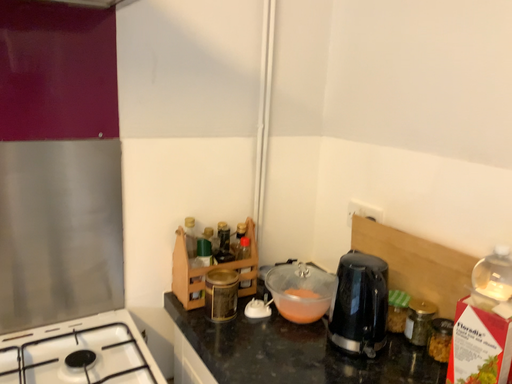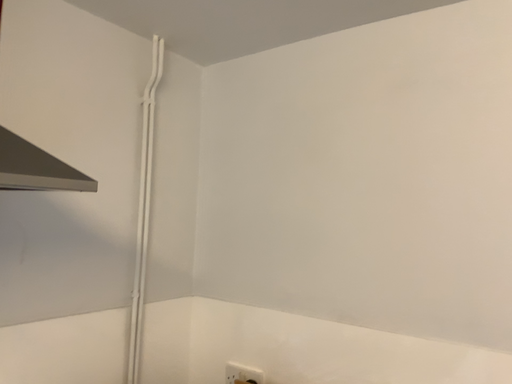
Question: Which way did the camera rotate in the video?

Choices:
 (A) rotated right
 (B) rotated left

Answer: (A)